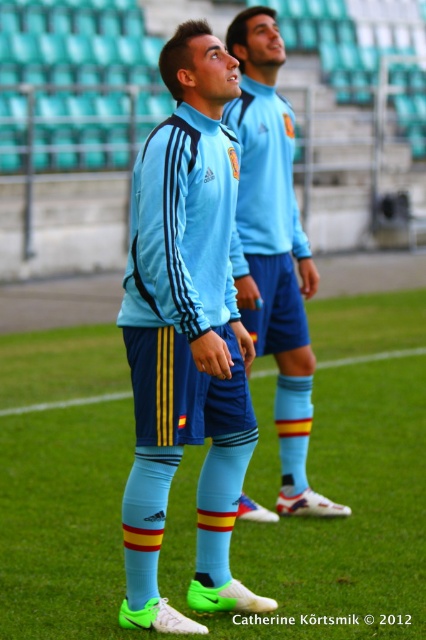
Question: Is light blue matte jersey at center to the left of light blue jersey at center from the viewer's perspective?

Choices:
 (A) no
 (B) yes

Answer: (B)

Question: Which object appears closest to the camera in this image?

Choices:
 (A) light blue fabric socks at center
 (B) blue matte soccer uniform at center

Answer: (A)

Question: Among these objects, which one is farthest from the camera?

Choices:
 (A) blue matte soccer uniform at center
 (B) blue fabric shorts at center
 (C) light blue fabric socks at center

Answer: (B)

Question: Can you confirm if light blue fabric socks at center is positioned to the left of matte blue tracksuit at center?

Choices:
 (A) no
 (B) yes

Answer: (B)

Question: Which point is farther to the camera?

Choices:
 (A) (247, 29)
 (B) (137, 614)
 (C) (143, 193)

Answer: (A)

Question: Does light blue fabric socks at center have a larger size compared to light blue matte jersey at center?

Choices:
 (A) no
 (B) yes

Answer: (A)